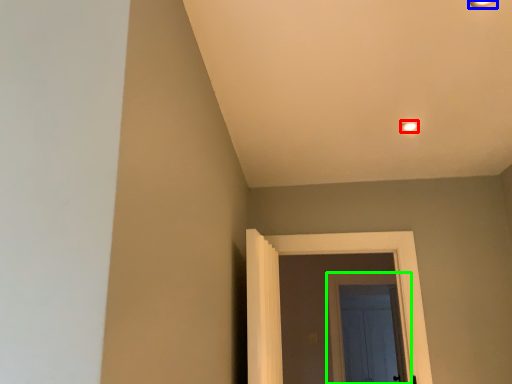
Question: Which object is positioned closest to light fixture (highlighted by a red box)? Select from light fixture (highlighted by a blue box) and door (highlighted by a green box).

Choices:
 (A) light fixture
 (B) door

Answer: (A)